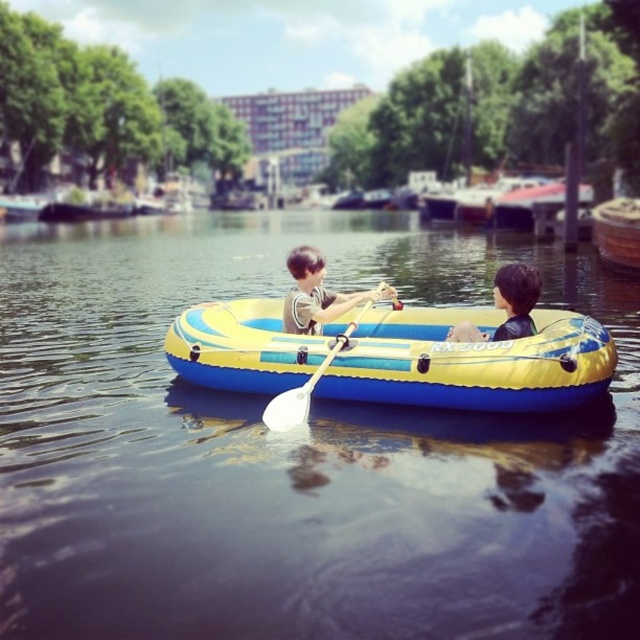
Question: Does matte black shirt at center have a smaller size compared to white plastic paddle at center?

Choices:
 (A) yes
 (B) no

Answer: (A)

Question: Is the position of matte black shirt at center more distant than that of white plastic paddle at center?

Choices:
 (A) yes
 (B) no

Answer: (A)

Question: Which of the following is the farthest from the observer?

Choices:
 (A) white plastic paddle at center
 (B) yellow/blue rubber boat at center
 (C) matte black shirt at center
 (D) blue rubber boat at center

Answer: (B)

Question: Can you confirm if matte black shirt at center is positioned above white plastic paddle at center?

Choices:
 (A) no
 (B) yes

Answer: (B)

Question: Which object is farther from the camera taking this photo?

Choices:
 (A) matte black shirt at center
 (B) blue rubber boat at center

Answer: (A)

Question: Estimate the real-world distances between objects in this image. Which object is farther from the white plastic paddle at center?

Choices:
 (A) matte black shirt at center
 (B) blue rubber boat at center

Answer: (B)